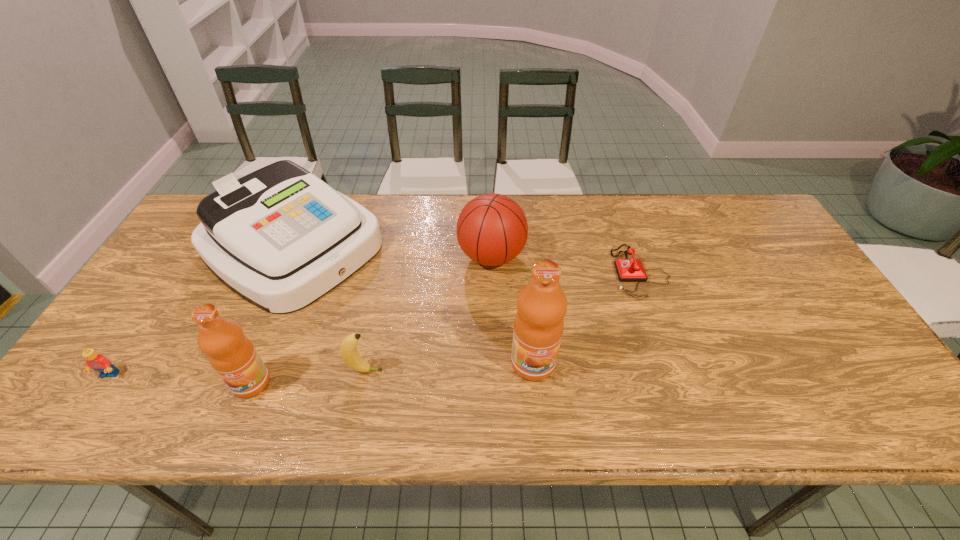
Find the location of `vacant space that satisfies the following two spatial constraints: 1. from the stem of the third shortest object; 2. on the label side of the left fruit juice`. vacant space that satisfies the following two spatial constraints: 1. from the stem of the third shortest object; 2. on the label side of the left fruit juice is located at coordinates (362, 382).

The image size is (960, 540). I want to click on free space that satisfies the following two spatial constraints: 1. from the stem of the banana; 2. on the label side of the shorter fruit juice, so click(x=362, y=382).

Identify the location of free space that satisfies the following two spatial constraints: 1. on the dial of the shortest object; 2. on the label side of the left fruit juice. This screenshot has height=540, width=960. (679, 382).

You are a GUI agent. You are given a task and a screenshot of the screen. Output one action in this format:
    pyautogui.click(x=<x>, y=<y>)
    Task: Click on the free location that satisfies the following two spatial constraints: 1. on the front side of the basketball; 2. on the right side of the cash register
    
    Given the screenshot: What is the action you would take?
    pyautogui.click(x=290, y=256)

You are a GUI agent. You are given a task and a screenshot of the screen. Output one action in this format:
    pyautogui.click(x=<x>, y=<y>)
    Task: Click on the vacant point that satisfies the following two spatial constraints: 1. from the stem of the banana; 2. on the label side of the left fruit juice
    This screenshot has height=540, width=960.
    Given the screenshot: What is the action you would take?
    362,382